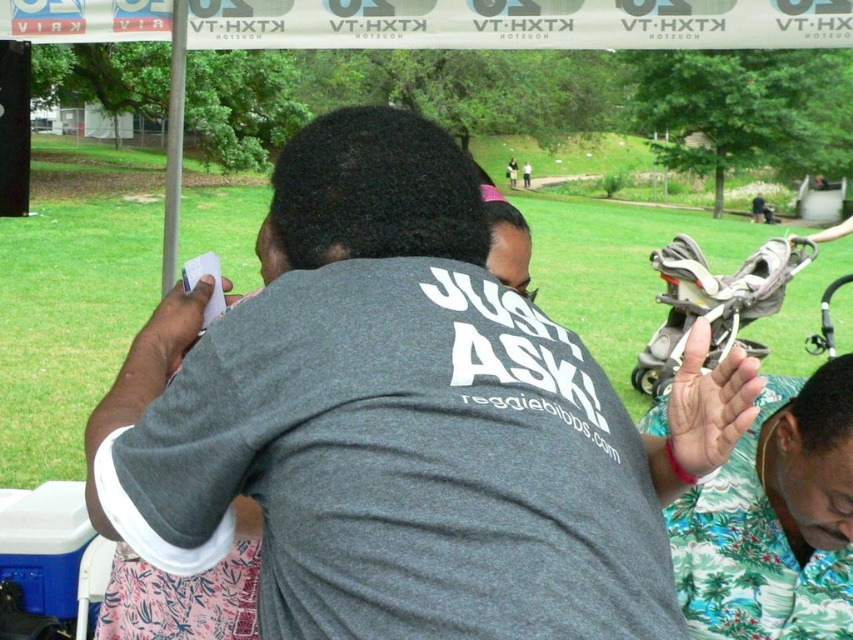
Question: Which point appears closest to the camera in this image?

Choices:
 (A) (509, 29)
 (B) (785, 401)
 (C) (366, 224)

Answer: (C)

Question: Is gray matte t-shirt at center closer to camera compared to green floral shirt at lower right?

Choices:
 (A) no
 (B) yes

Answer: (B)

Question: Is gray matte t-shirt at center bigger than green floral shirt at lower right?

Choices:
 (A) no
 (B) yes

Answer: (B)

Question: Which point appears farthest from the camera in this image?

Choices:
 (A) (717, 1)
 (B) (743, 524)

Answer: (A)

Question: Which object is the closest to the white fabric canopy at upper center?

Choices:
 (A) gray matte t-shirt at center
 (B) green floral shirt at lower right

Answer: (B)

Question: Is green floral shirt at lower right above white fabric canopy at upper center?

Choices:
 (A) no
 (B) yes

Answer: (A)